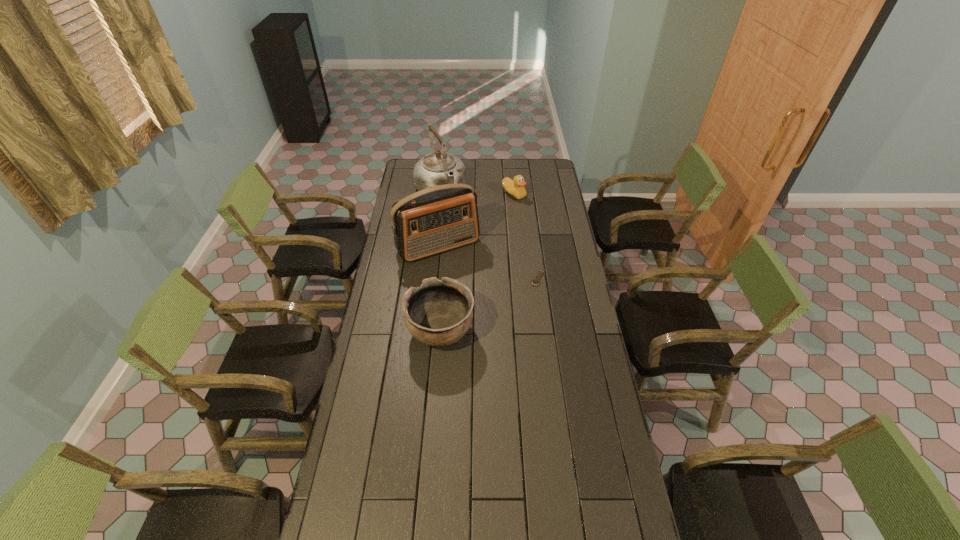
Find the location of a particular element. Image resolution: width=960 pixels, height=540 pixels. vacant spot on the desktop that is between the third shortest object and the shortest object and is positioned on the front-facing side of the third nearest object is located at coordinates (478, 311).

Locate an element on the screen. This screenshot has width=960, height=540. vacant spot on the desktop that is between the third tallest object and the watch and is positioned at the spout of the kettle is located at coordinates (507, 295).

The width and height of the screenshot is (960, 540). What are the coordinates of `vacant spot on the desktop that is between the third shortest object and the shortest object and is positioned at the beak of the second shortest object` in the screenshot? It's located at (499, 300).